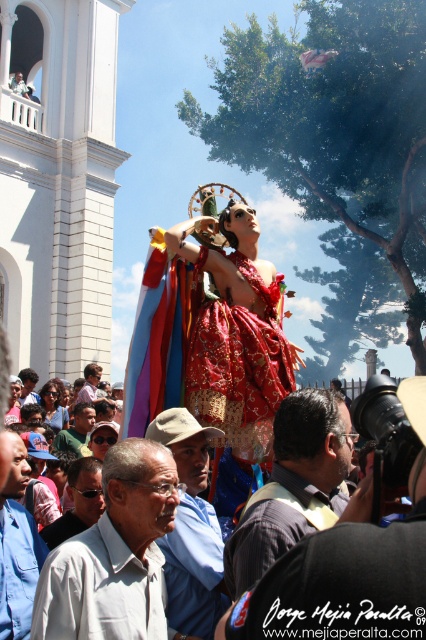
You are a photographer standing at the camera position. You want to take a closeup photo of the matte brown shirt at center. Can you reach the subject without moving from your current position?

The matte brown shirt at center is 26.17 meters away from camera, so you cannot reach the subject without moving from your current position for a closeup photo.

You are a photographer trying to capture a photo of the statue of the saint. You notice two people in the foreground wearing a matte brown shirt at center and a blue shirt at center. Which shirt should you adjust your focus to avoid blurring, considering their sizes?

The matte brown shirt at center is larger than the blue shirt at center, so adjusting focus on the larger matte brown shirt at center would help avoid blurring due to its size.